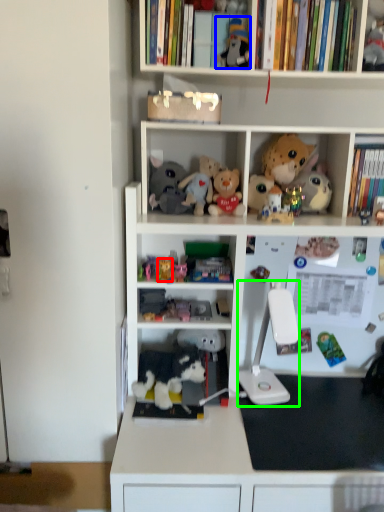
Question: Which object is the closest to the toy (highlighted by a red box)? Choose among these: toy (highlighted by a blue box) or equipment (highlighted by a green box).

Choices:
 (A) toy
 (B) equipment

Answer: (B)